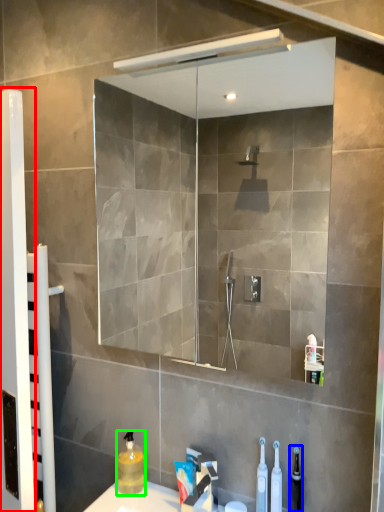
Question: Based on their relative distances, which object is nearer to screen door (highlighted by a red box)? Choose from toiletry (highlighted by a blue box) and cleaning product (highlighted by a green box).

Choices:
 (A) toiletry
 (B) cleaning product

Answer: (B)